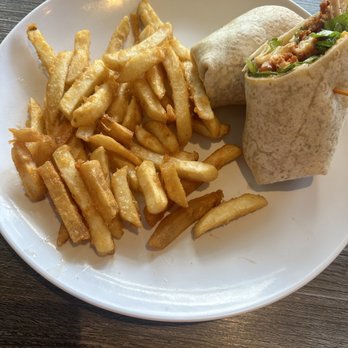
At what (x,y) coordinates should I click in order to perform the action: click on top of table. Please return your answer as a coordinate pair (x, y). The height and width of the screenshot is (348, 348). Looking at the image, I should click on (305, 325), (336, 288), (26, 281), (36, 318).